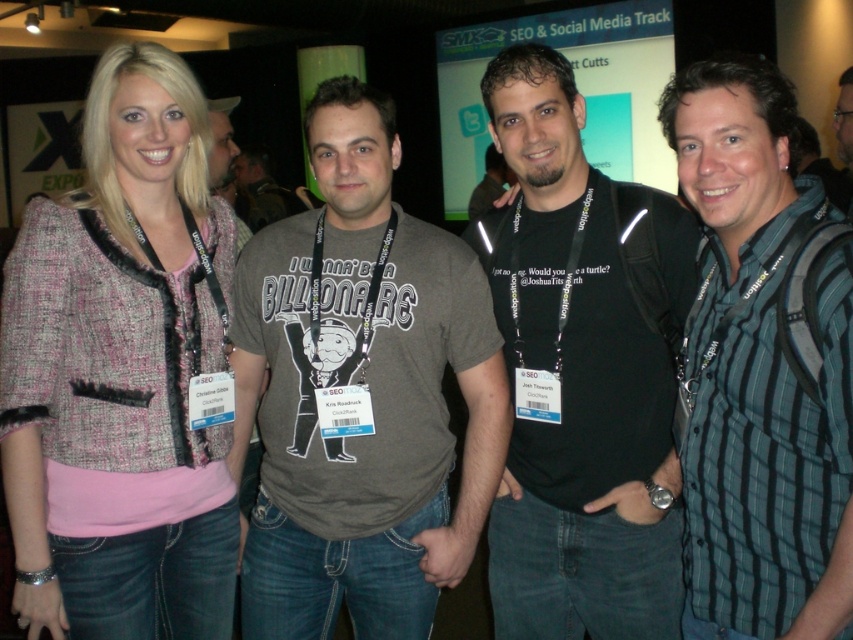
How much distance is there between pink tweed jacket at upper left and striped cotton shirt at right?

pink tweed jacket at upper left is 3.38 feet away from striped cotton shirt at right.

Who is more distant from viewer, (103, 260) or (756, 90)?

The point (103, 260) is behind.

This screenshot has width=853, height=640. What are the coordinates of `pink tweed jacket at upper left` in the screenshot? It's located at (120, 372).

Which is in front, point (650, 308) or point (744, 179)?

Positioned in front is point (744, 179).

Does black matte t-shirt at center appear on the right side of striped cotton shirt at right?

In fact, black matte t-shirt at center is to the left of striped cotton shirt at right.

Between point (553, 282) and point (685, 86), which one is positioned behind?

Point (553, 282)

Locate an element on the screen. Image resolution: width=853 pixels, height=640 pixels. black matte t-shirt at center is located at coordinates (582, 374).

Image resolution: width=853 pixels, height=640 pixels. Describe the element at coordinates (360, 388) in the screenshot. I see `matte gray t-shirt at center` at that location.

Is matte gray t-shirt at center bigger than dark gray t-shirt at center?

Indeed, matte gray t-shirt at center has a larger size compared to dark gray t-shirt at center.

Is point (368, 145) in front of point (482, 189)?

That is True.

Locate an element on the screen. The image size is (853, 640). matte gray t-shirt at center is located at coordinates (360, 388).